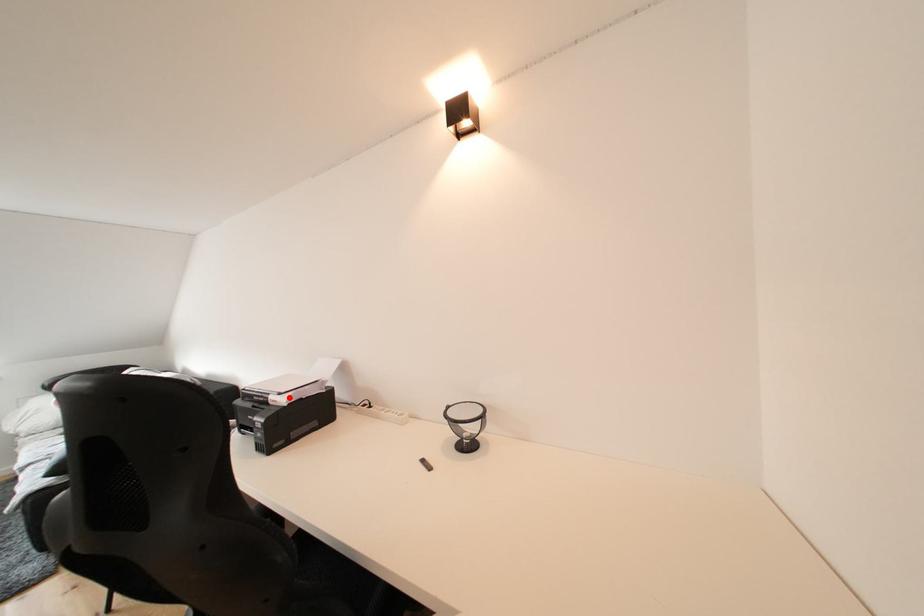
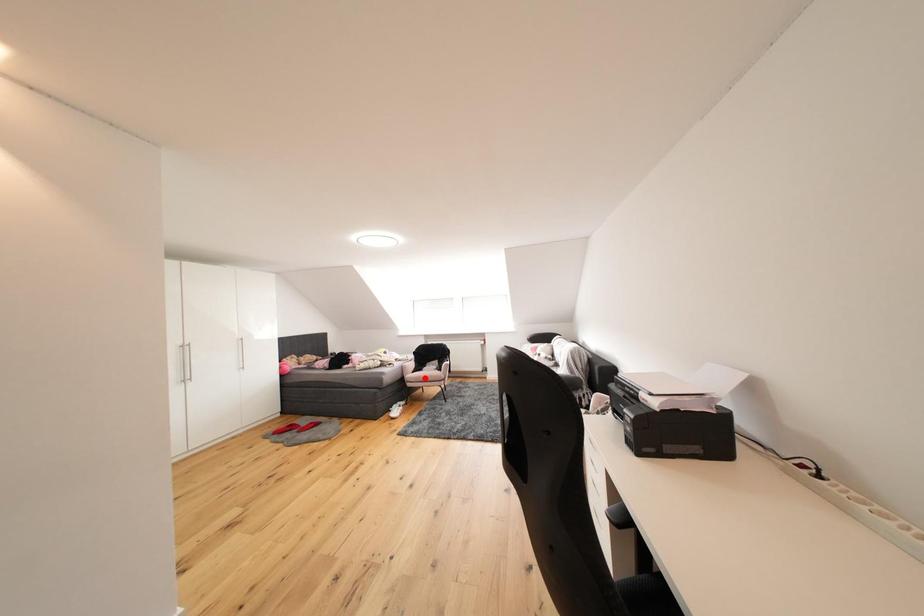
I am providing you with two images of the same scene from different viewpoints. A red point is marked on the first image and another point is marked on the second image. Is the red point in image1 aligned with the point shown in image2?

No